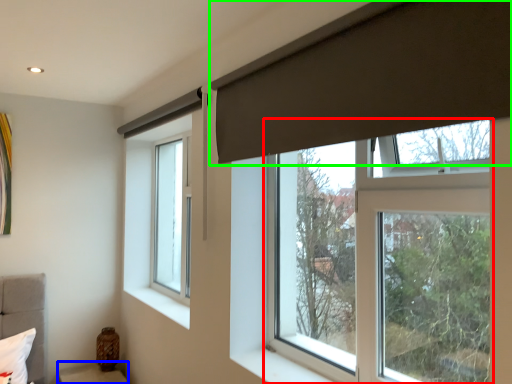
Question: Considering the real-world distances, which object is farthest from window (highlighted by a red box)? furniture (highlighted by a blue box) or curtain (highlighted by a green box)?

Choices:
 (A) furniture
 (B) curtain

Answer: (A)